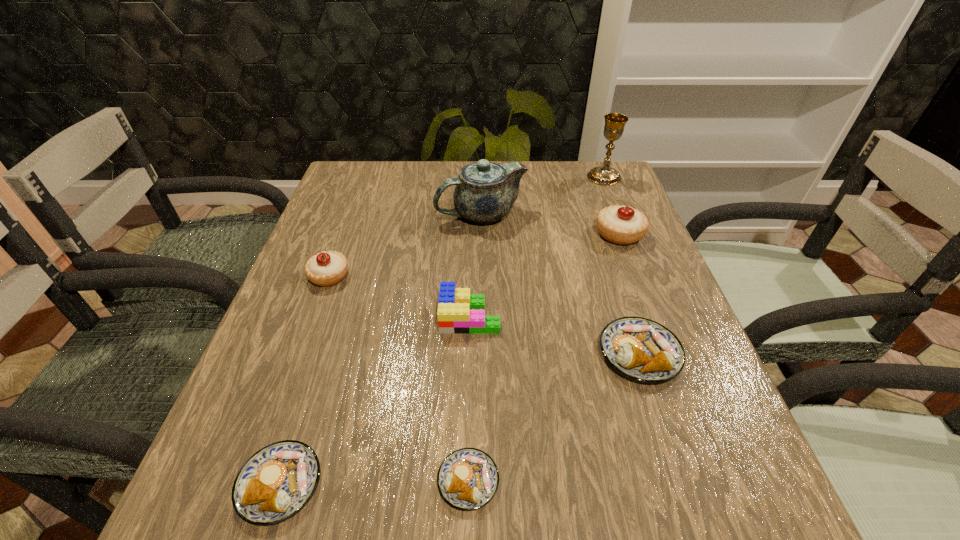
Where is `the second smallest brown pastry`? The height and width of the screenshot is (540, 960). the second smallest brown pastry is located at coordinates click(x=277, y=481).

Image resolution: width=960 pixels, height=540 pixels. What are the coordinates of `the shortest pastry` in the screenshot? It's located at (468, 478).

Where is `the third pastry from left to right`? The width and height of the screenshot is (960, 540). the third pastry from left to right is located at coordinates coord(468,478).

Locate an element on the screen. This screenshot has height=540, width=960. vacant space located on the front of the farthest object is located at coordinates (620, 217).

The width and height of the screenshot is (960, 540). I want to click on free space located 0.120m from the spout of the chinaware, so click(x=389, y=214).

Where is `vacant area located from the spout of the chinaware`? The height and width of the screenshot is (540, 960). vacant area located from the spout of the chinaware is located at coordinates (343, 214).

This screenshot has height=540, width=960. Identify the location of vacant space located from the spout of the chinaware. (366, 214).

Where is `vacant space located on the front of the tallest pastry`? vacant space located on the front of the tallest pastry is located at coordinates (647, 309).

The width and height of the screenshot is (960, 540). In order to click on vacant point located on the front of the fourth shortest pastry in this screenshot , I will do `click(311, 326)`.

Where is `free point located 0.300m on the right of the green Lego`? The height and width of the screenshot is (540, 960). free point located 0.300m on the right of the green Lego is located at coordinates (649, 316).